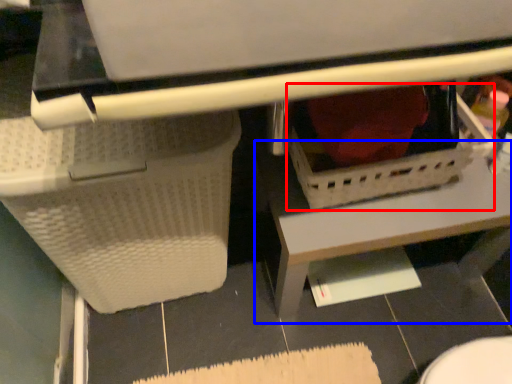
Question: Which object appears farthest to the camera in this image, basket (highlighted by a red box) or table (highlighted by a blue box)?

Choices:
 (A) basket
 (B) table

Answer: (B)